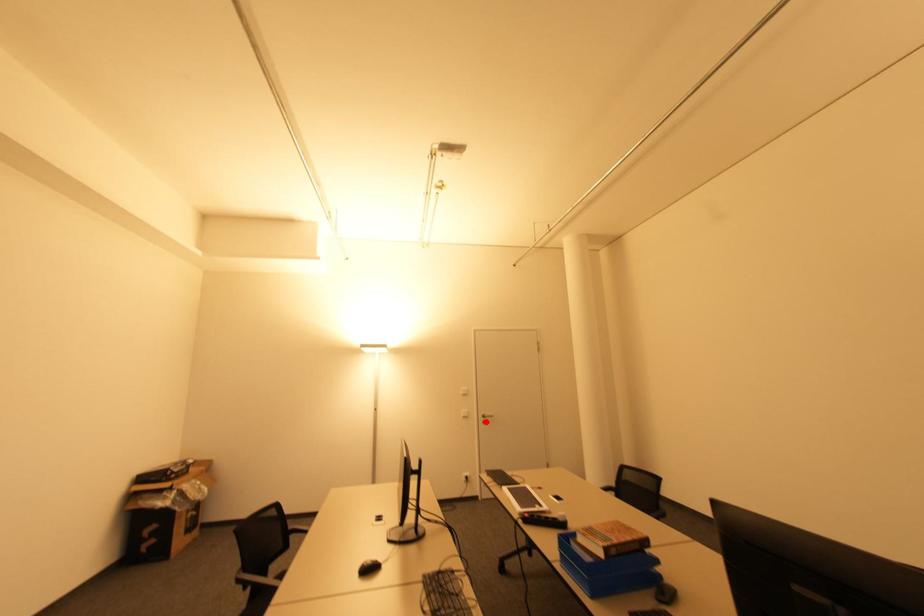
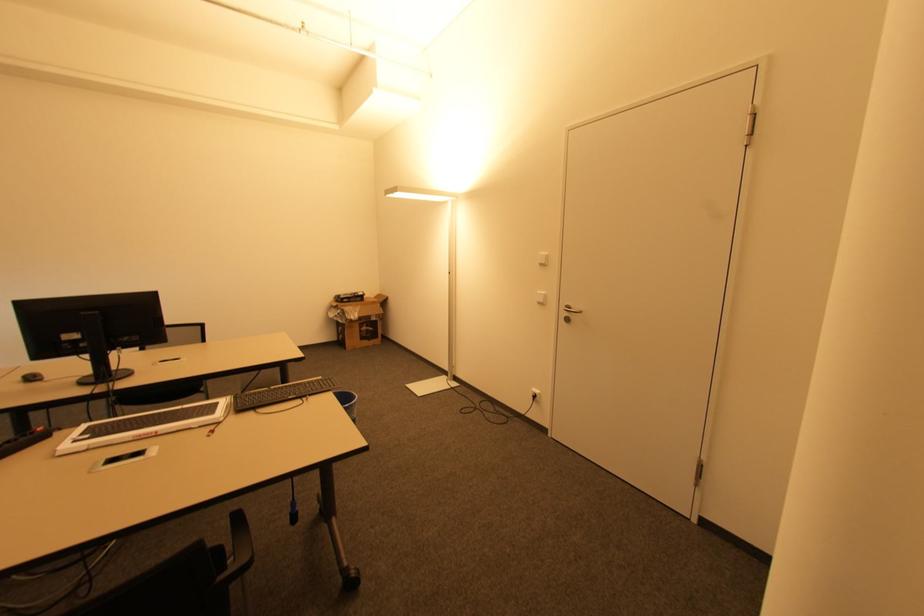
Find the pixel in the second image that matches the highlighted location in the first image.

(568, 320)